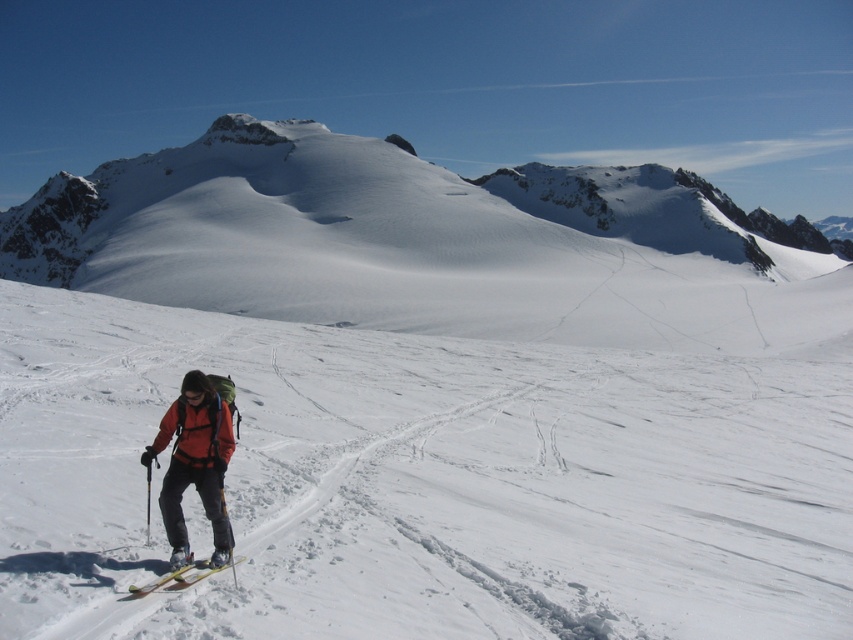
Which of these two, orange softshell jacket at lower left or yellow matte ski at lower left, stands taller?

With more height is orange softshell jacket at lower left.

Can you confirm if orange softshell jacket at lower left is positioned below yellow matte ski at lower left?

No, orange softshell jacket at lower left is not below yellow matte ski at lower left.

Between point (213, 524) and point (190, 573), which one is positioned in front?

Point (190, 573)

Where is `orange softshell jacket at lower left`? This screenshot has height=640, width=853. orange softshell jacket at lower left is located at coordinates point(194,465).

Is white snow-covered mountain at center smaller than orange softshell jacket at lower left?

No, white snow-covered mountain at center is not smaller than orange softshell jacket at lower left.

Which of these two, white snow-covered mountain at center or orange softshell jacket at lower left, stands taller?

Standing taller between the two is white snow-covered mountain at center.

Consider the image. Who is more forward, (462,244) or (183,442)?

Point (183,442) is in front.

The width and height of the screenshot is (853, 640). I want to click on white snow-covered mountain at center, so click(x=426, y=244).

Who is higher up, white powder snow at center or yellow matte ski at lower left?

white powder snow at center is higher up.

Can you confirm if white powder snow at center is positioned to the left of yellow matte ski at lower left?

No, white powder snow at center is not to the left of yellow matte ski at lower left.

From the picture: Measure the distance between point (682, 499) and camera.

21.02 meters

What are the coordinates of `white powder snow at center` in the screenshot? It's located at (422, 483).